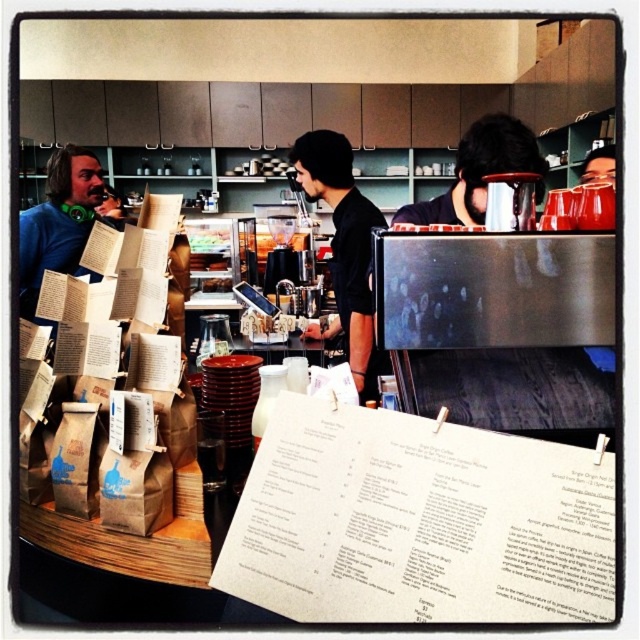
Question: Which of the following is the closest to the observer?

Choices:
 (A) black matte shirt at center
 (B) white paper menu at center

Answer: (B)

Question: Among these points, which one is farthest from the camera?

Choices:
 (A) (381, 225)
 (B) (456, 458)

Answer: (A)

Question: Considering the relative positions of white paper menu at center and black matte shirt at center in the image provided, where is white paper menu at center located with respect to black matte shirt at center?

Choices:
 (A) right
 (B) left

Answer: (B)

Question: Does white paper menu at center appear on the left side of black matte shirt at center?

Choices:
 (A) yes
 (B) no

Answer: (A)

Question: Considering the relative positions of white paper menu at center and black matte shirt at center in the image provided, where is white paper menu at center located with respect to black matte shirt at center?

Choices:
 (A) right
 (B) left

Answer: (B)